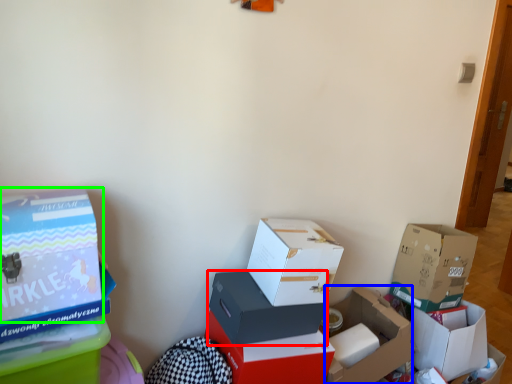
Question: Considering the real-world distances, which object is farthest from box (highlighted by a red box)? box (highlighted by a blue box) or box (highlighted by a green box)?

Choices:
 (A) box
 (B) box

Answer: (B)